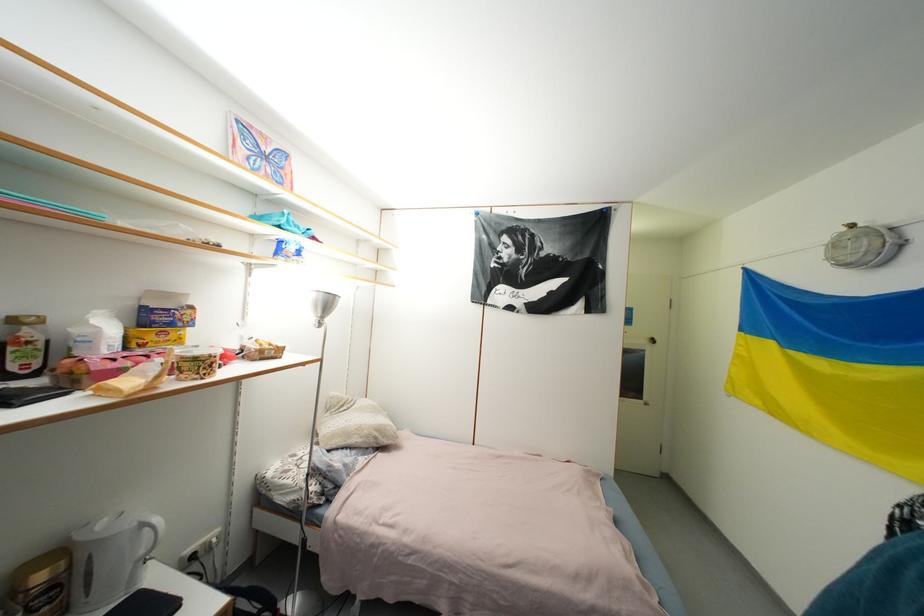
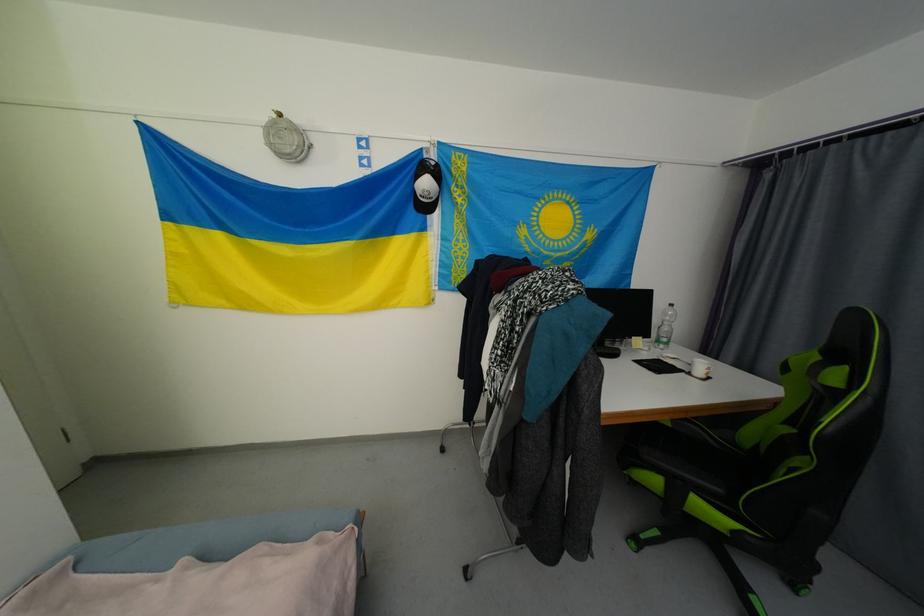
From the picture: First-person continuous shooting, in which direction is the camera rotating?

The rotation direction of the camera is right-down.